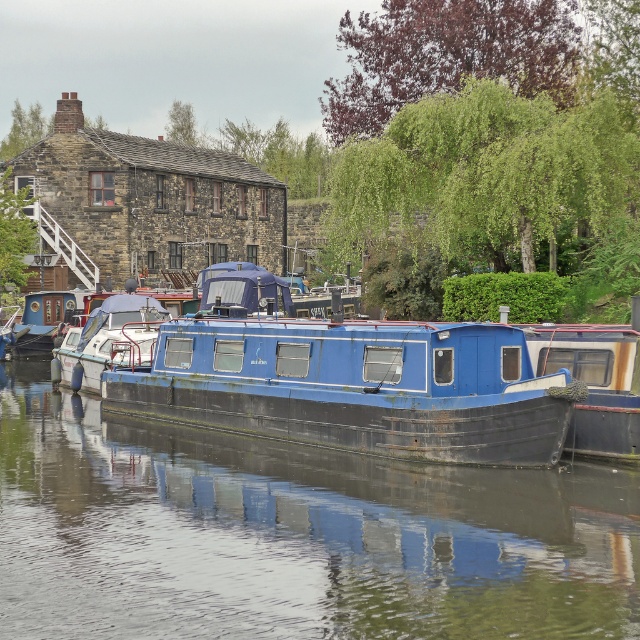
You are a delivery person trying to load a tall package onto a boat. You see the blue matte barge at center and the blue painted wood boat at center. Which boat can accommodate the tall package based on their heights?

The blue matte barge at center has a greater height compared to the blue painted wood boat at center, so it can accommodate the tall package.

You are standing at the water level near the blue narrowboat and want to reach the point marked at coordinates point (212, 588). Is this point within a safe distance for you to swim to without needing assistance?

The point point (212, 588) is 10.90 meters away from the viewer, so it may be challenging to swim that distance without assistance. Consider using a boat or asking for help.